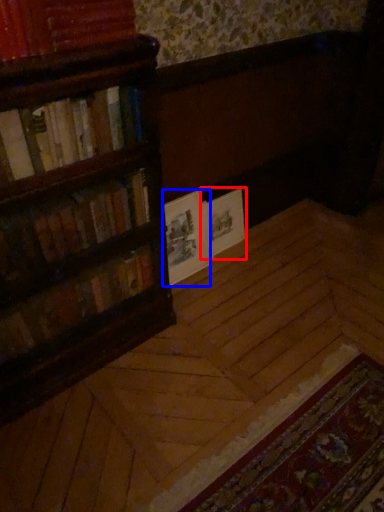
Question: Which object is further to the camera taking this photo, book cover (highlighted by a red box) or paperback book (highlighted by a blue box)?

Choices:
 (A) book cover
 (B) paperback book

Answer: (A)